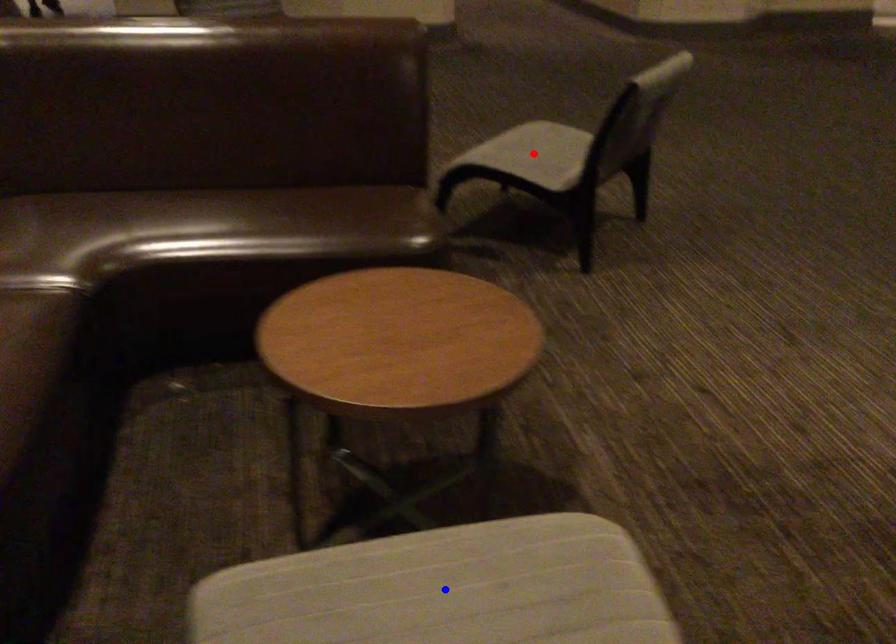
Question: Which of the two points in the image is closer to the camera?

Choices:
 (A) Blue point is closer.
 (B) Red point is closer.

Answer: (A)